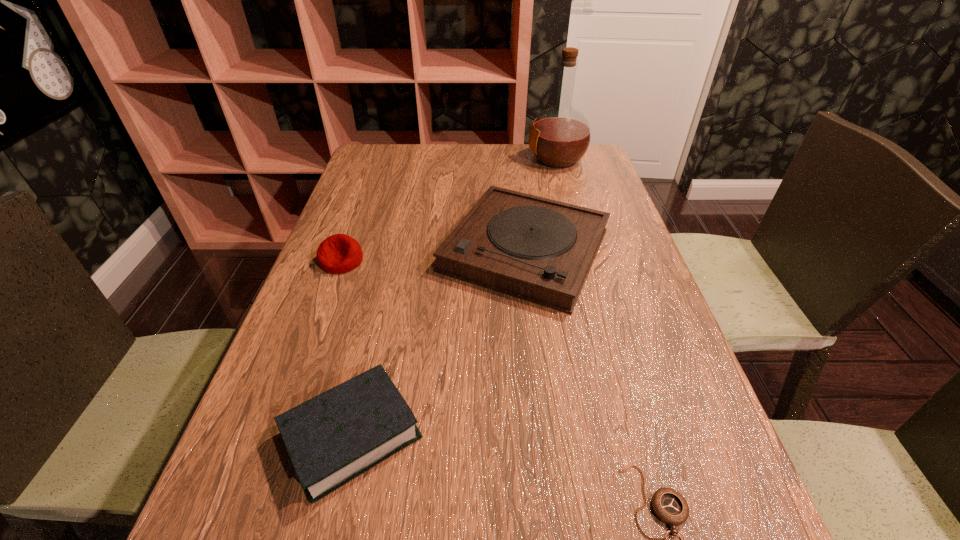
This screenshot has width=960, height=540. Identify the location of the farthest object. (560, 136).

Image resolution: width=960 pixels, height=540 pixels. I want to click on liquor, so click(560, 136).

Where is `phonograph record`? The width and height of the screenshot is (960, 540). phonograph record is located at coordinates (536, 249).

Identify the location of beanbag. (339, 253).

Locate an element on the screen. The image size is (960, 540). Bible is located at coordinates (332, 438).

Locate an element on the screen. vacant space situated 0.370m on the front label of the farthest object is located at coordinates (409, 159).

This screenshot has width=960, height=540. Identify the location of vacant space situated on the front label of the farthest object. (447, 159).

Locate an element on the screen. The image size is (960, 540). blank space located on the front label of the farthest object is located at coordinates (495, 159).

The height and width of the screenshot is (540, 960). Identify the location of free space located on the front of the phonograph record. (551, 467).

Find the location of a particular element. free region located on the seat area of the beanbag is located at coordinates (280, 429).